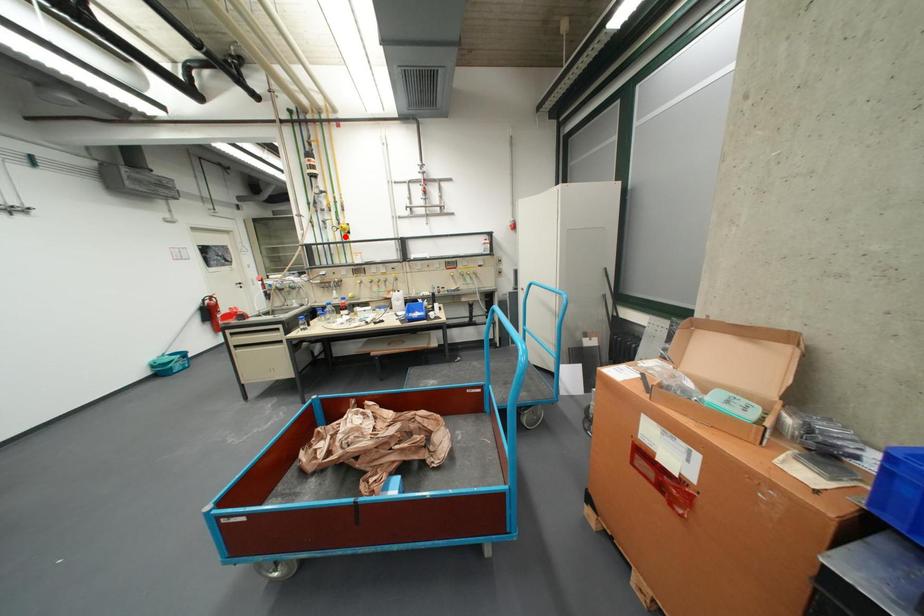
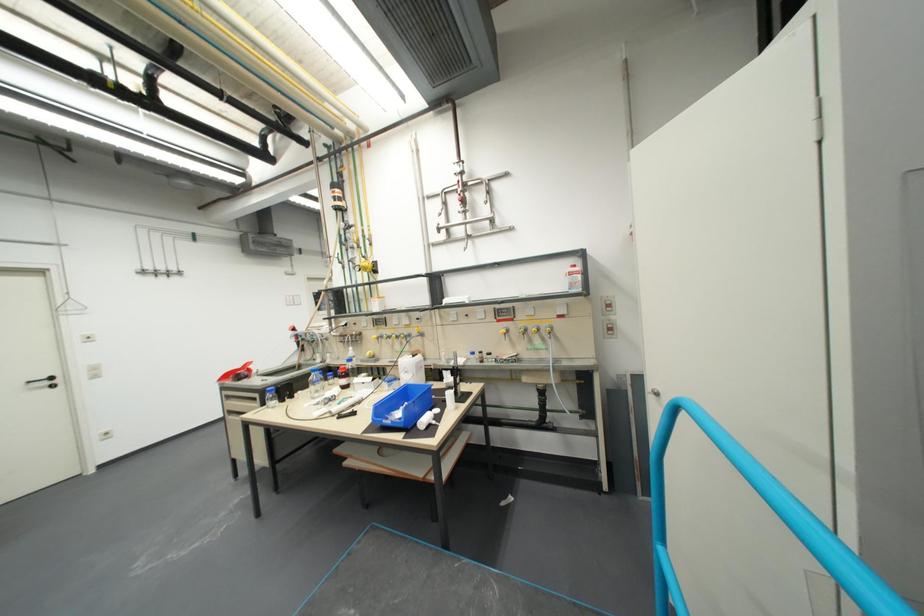
Where in the second image is the point corresponding to the highlighted location from the first image?

(373, 278)